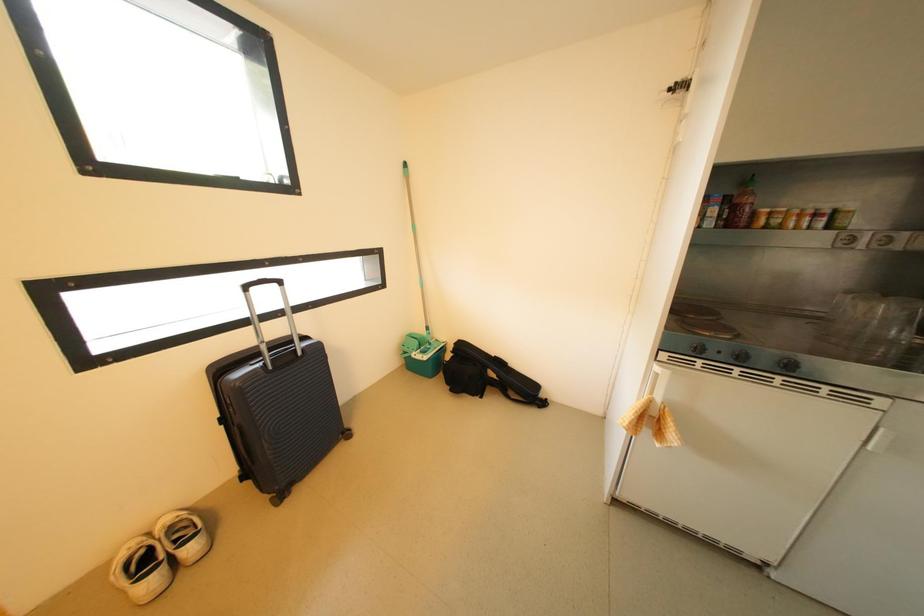
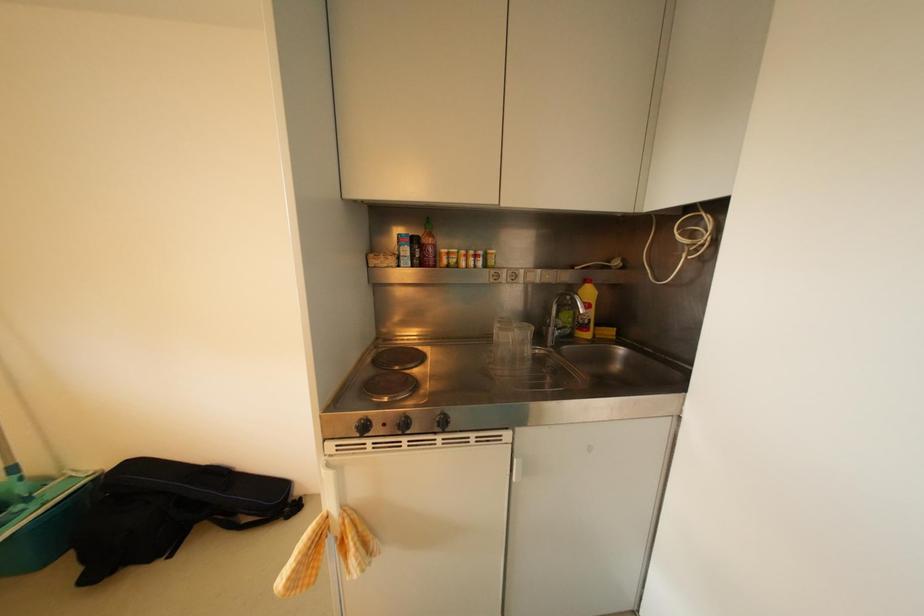
Question: The camera is either moving clockwise (left) or counter-clockwise (right) around the object. The first image is from the beginning of the video and the second image is from the end. Is the camera moving left or right when shooting the video?

Choices:
 (A) Left
 (B) Right

Answer: (A)